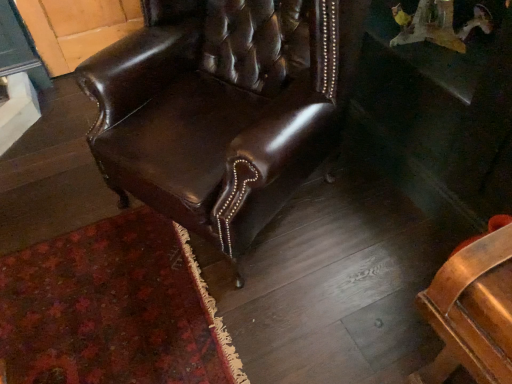
The height and width of the screenshot is (384, 512). Identify the location of free space in front of shiny brown leather chair at center. (231, 321).